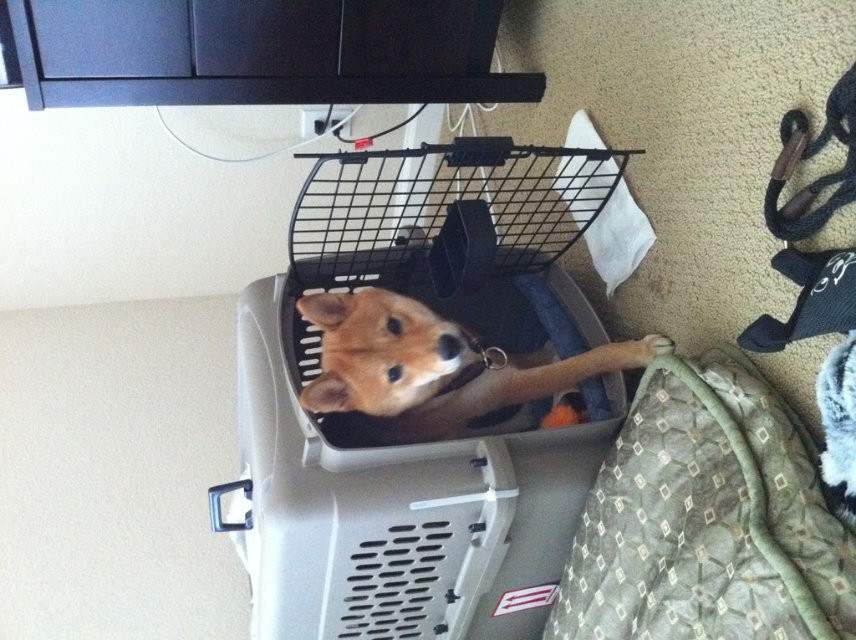
Does green quilted dog bed at lower right have a lesser height compared to golden fur dog at center?

Incorrect, green quilted dog bed at lower right's height does not fall short of golden fur dog at center's.

Can you confirm if green quilted dog bed at lower right is positioned below golden fur dog at center?

Yes.

Is point (629, 538) more distant than point (407, 364)?

That is False.

Where is `green quilted dog bed at lower right`? The image size is (856, 640). green quilted dog bed at lower right is located at coordinates (706, 518).